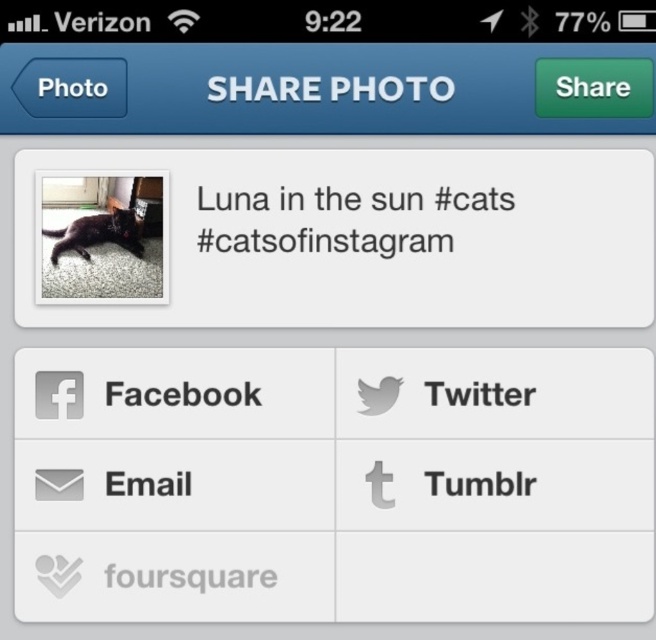
Between gray matte tumblr at center and gray matte twitter at center, which one appears on the right side from the viewer's perspective?

gray matte tumblr at center

Does gray matte tumblr at center have a lesser height compared to gray matte twitter at center?

Yes.

Locate an element on the screen. This screenshot has height=640, width=656. gray matte tumblr at center is located at coordinates (482, 484).

The height and width of the screenshot is (640, 656). What do you see at coordinates (96, 234) in the screenshot? I see `black fur cat at center` at bounding box center [96, 234].

Who is lower down, black fur cat at center or gray matte twitter at center?

gray matte twitter at center

Which is behind, point (79, 253) or point (508, 397)?

The point (79, 253) is behind.

This screenshot has height=640, width=656. In order to click on black fur cat at center in this screenshot , I will do `click(96, 234)`.

Who is positioned more to the right, black matte cat at upper left or black fur cat at center?

Positioned to the right is black matte cat at upper left.

Between black matte cat at upper left and black fur cat at center, which one appears on the left side from the viewer's perspective?

black fur cat at center

Who is more distant from viewer, (234, 236) or (102, 228)?

The point (102, 228) is more distant.

You are a GUI agent. You are given a task and a screenshot of the screen. Output one action in this format:
    pyautogui.click(x=<x>, y=<y>)
    Task: Click on the black matte cat at upper left
    The image size is (656, 640).
    Given the screenshot: What is the action you would take?
    pyautogui.click(x=323, y=241)